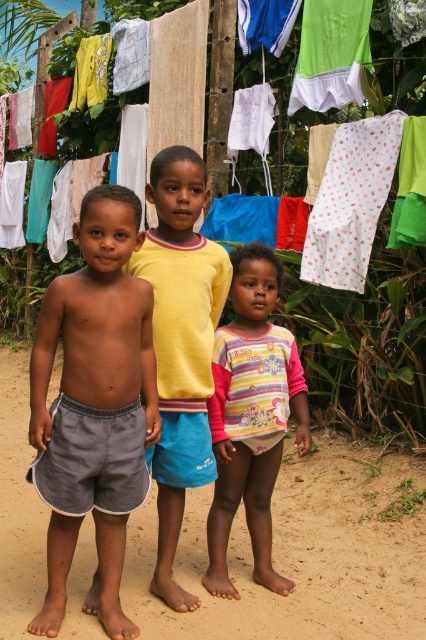
What is the color of the clothing item located at the coordinates point (95,403) in the image?

The point (95,403) marks gray fabric shorts at left, so the color is gray.

You are a photographer trying to capture the gray fabric shorts at left in the image. Based on its 2D coordinates, where should you position your camera to ensure it is centered in the frame?

To center the gray fabric shorts at left in the frame, position your camera so that the center of the frame aligns with the coordinates point (95, 403).